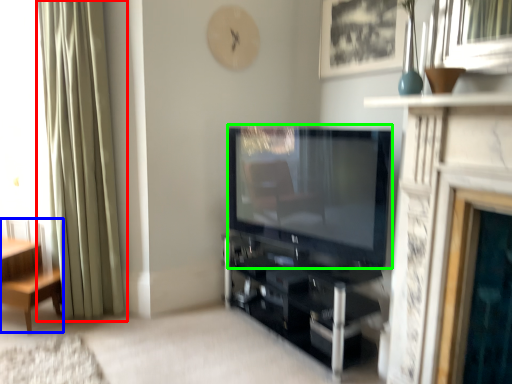
Question: Which object is the closest to the curtain (highlighted by a red box)? Choose among these: furniture (highlighted by a blue box) or television (highlighted by a green box).

Choices:
 (A) furniture
 (B) television

Answer: (A)